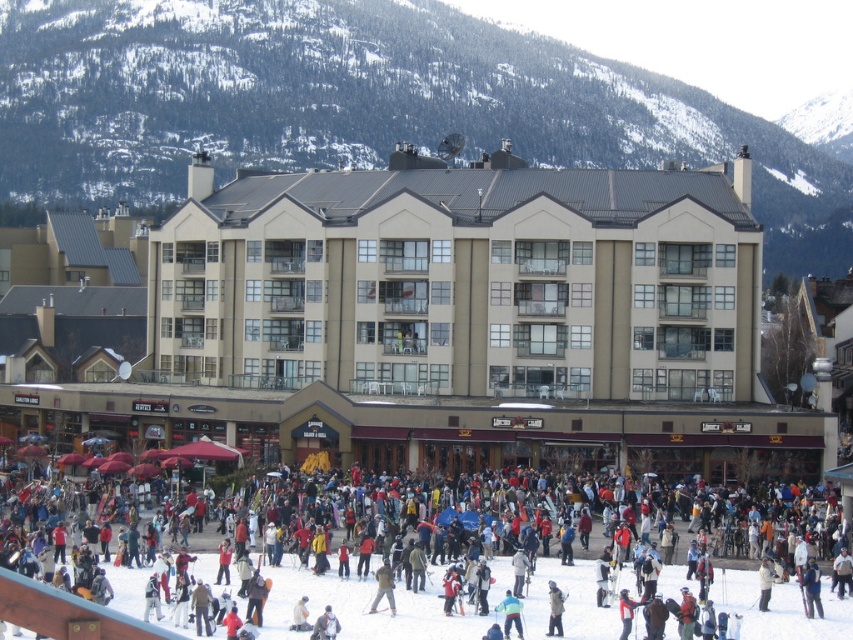
Which is in front, point (378, 596) or point (321, 618)?

Point (321, 618) is in front.

The width and height of the screenshot is (853, 640). What do you see at coordinates (384, 588) in the screenshot?
I see `khaki fabric jacket at center` at bounding box center [384, 588].

The width and height of the screenshot is (853, 640). Describe the element at coordinates (384, 588) in the screenshot. I see `khaki fabric jacket at center` at that location.

At what (x,y) coordinates should I click in order to perform the action: click on khaki fabric jacket at center. Please return your answer as a coordinate pair (x, y). Looking at the image, I should click on (384, 588).

Who is more forward, (495, 205) or (552, 589)?

Positioned in front is point (552, 589).

Does beige concrete building at center come in front of dark gray jacket at center?

No, it is not.

Locate an element on the screen. This screenshot has width=853, height=640. beige concrete building at center is located at coordinates (450, 324).

Between point (747, 262) and point (387, 561), which one is positioned in front?

Positioned in front is point (387, 561).

Who is taller, beige concrete building at center or khaki fabric jacket at center?

Standing taller between the two is beige concrete building at center.

Does point (635, 358) come closer to viewer compared to point (380, 579)?

No, it is behind (380, 579).

The height and width of the screenshot is (640, 853). Find the location of `beige concrete building at center`. beige concrete building at center is located at coordinates (450, 324).